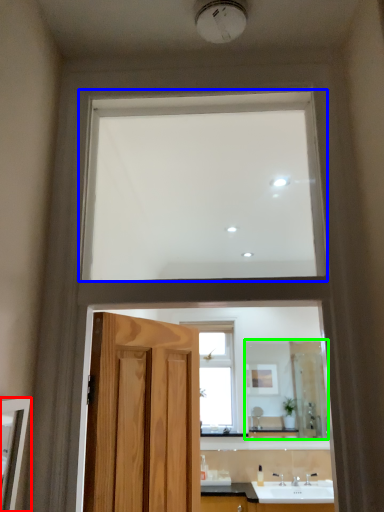
Question: Which object is positioned closest to mirror (highlighted by a red box)? Select from window (highlighted by a blue box) and mirror (highlighted by a green box).

Choices:
 (A) window
 (B) mirror

Answer: (A)